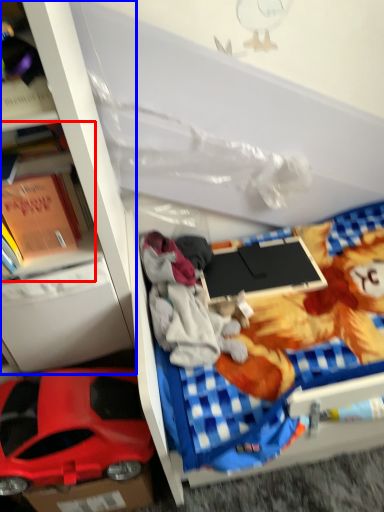
Question: Among these objects, which one is farthest to the camera, book (highlighted by a red box) or bookshelf (highlighted by a blue box)?

Choices:
 (A) book
 (B) bookshelf

Answer: (A)